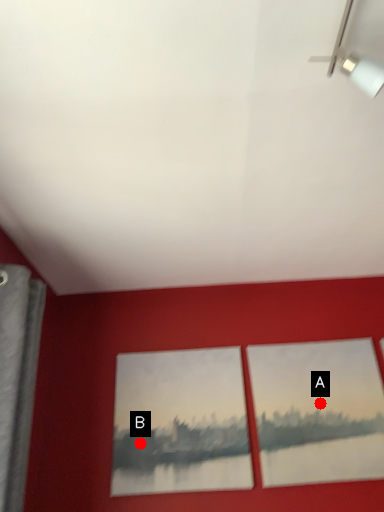
Question: Two points are circled on the image, labeled by A and B beside each circle. Among these points, which one is nearest to the camera?

Choices:
 (A) A is closer
 (B) B is closer

Answer: (B)